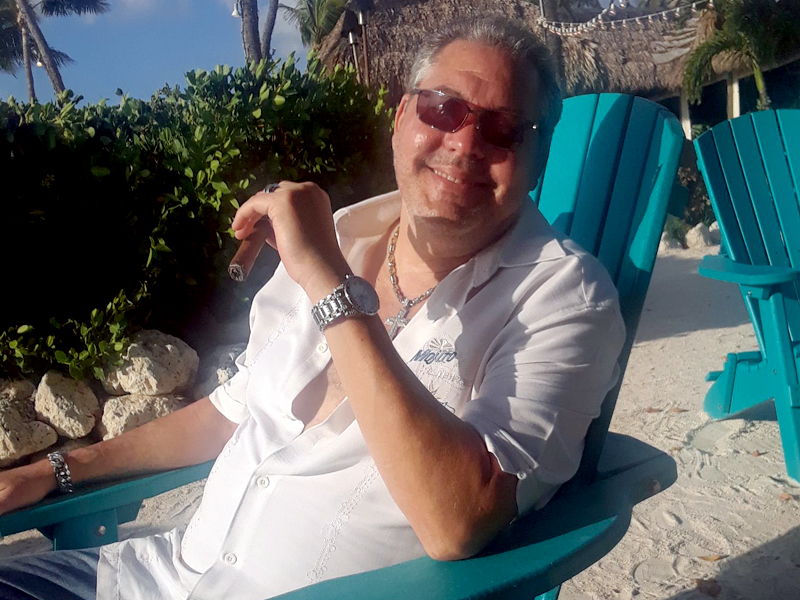
I want to click on decorative lights, so click(x=596, y=16).